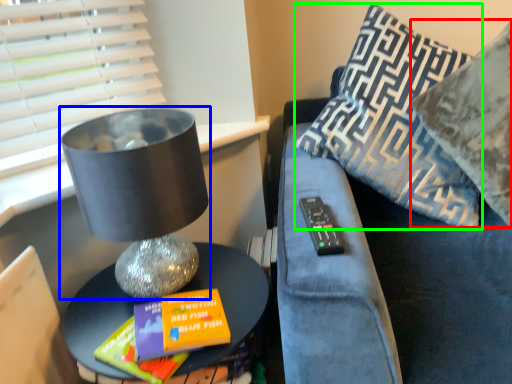
Question: Considering the real-world distances, which object is closest to pillow (highlighted by a red box)? table lamp (highlighted by a blue box) or pillow (highlighted by a green box).

Choices:
 (A) table lamp
 (B) pillow

Answer: (B)